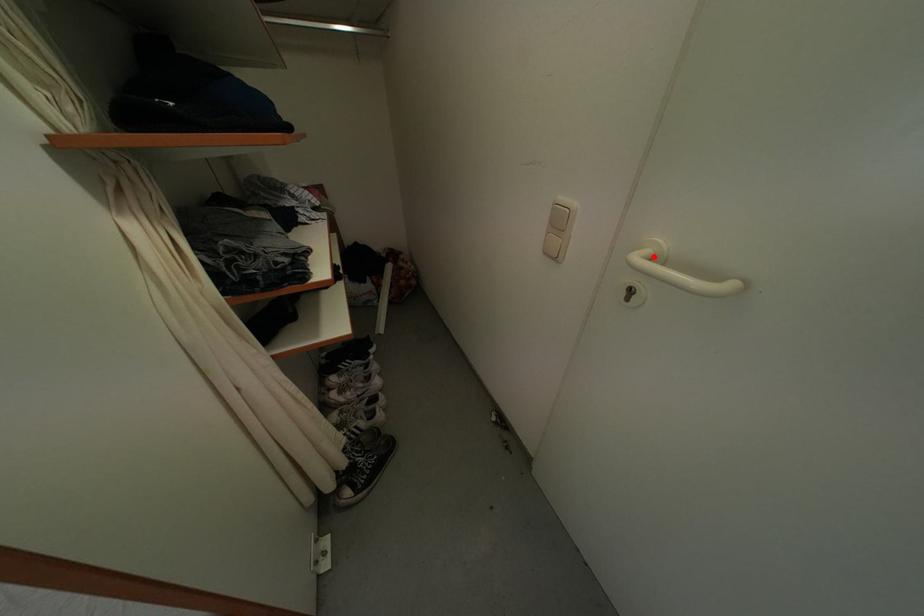
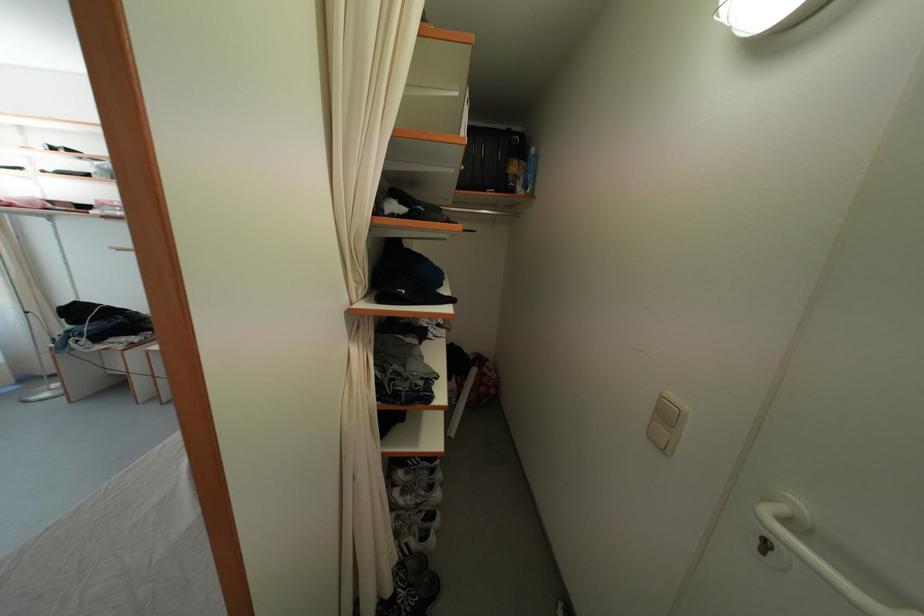
The point at the highlighted location is marked in the first image. Where is the corresponding point in the second image?

(787, 515)